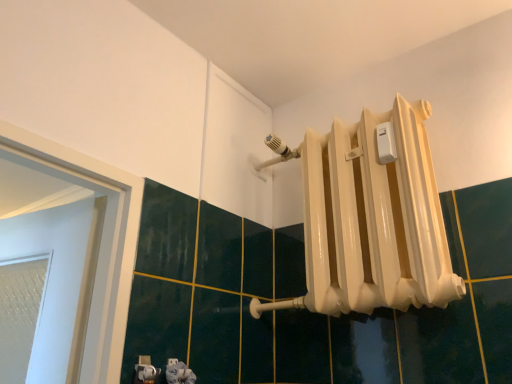
This screenshot has width=512, height=384. Describe the element at coordinates (372, 218) in the screenshot. I see `white glossy radiator at upper right` at that location.

Locate an element on the screen. This screenshot has height=384, width=512. white glossy radiator at upper right is located at coordinates (372, 218).

The image size is (512, 384). I want to click on white glossy radiator at upper right, so (372, 218).